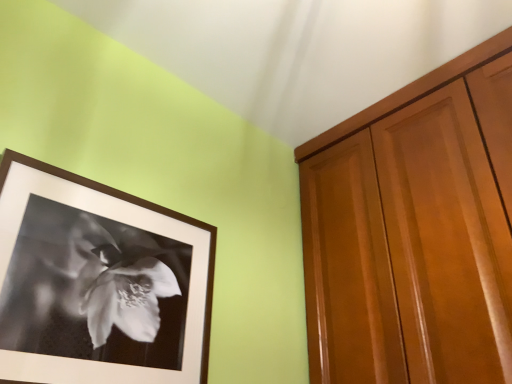
The image size is (512, 384). Describe the element at coordinates (414, 231) in the screenshot. I see `glossy wood cabinetry at right` at that location.

The height and width of the screenshot is (384, 512). What are the coordinates of `glossy wood cabinetry at right` in the screenshot? It's located at (414, 231).

The width and height of the screenshot is (512, 384). What do you see at coordinates (98, 282) in the screenshot?
I see `black matte picture frame at upper left` at bounding box center [98, 282].

I want to click on black matte picture frame at upper left, so click(98, 282).

At what (x,y) coordinates should I click in order to perform the action: click on glossy wood cabinetry at right. Please return your answer as a coordinate pair (x, y). Image resolution: width=512 pixels, height=384 pixels. Looking at the image, I should click on (414, 231).

Considering the positions of objects glossy wood cabinetry at right and black matte picture frame at upper left in the image provided, who is more to the left, glossy wood cabinetry at right or black matte picture frame at upper left?

Positioned to the left is black matte picture frame at upper left.

Is glossy wood cabinetry at right further to camera compared to black matte picture frame at upper left?

Answer: Yes, glossy wood cabinetry at right is further from the camera.

Which is in front, point (328, 378) or point (15, 346)?

Point (15, 346)

From the image's perspective, which is above, glossy wood cabinetry at right or black matte picture frame at upper left?

glossy wood cabinetry at right appears higher in the image.

In the scene shown: From a real-world perspective, is glossy wood cabinetry at right beneath black matte picture frame at upper left?

Incorrect, from a real-world perspective, glossy wood cabinetry at right is higher than black matte picture frame at upper left.

Which of these two, glossy wood cabinetry at right or black matte picture frame at upper left, is thinner?

black matte picture frame at upper left.

Does glossy wood cabinetry at right have a greater height compared to black matte picture frame at upper left?

Yes, glossy wood cabinetry at right is taller than black matte picture frame at upper left.

Is glossy wood cabinetry at right bigger or smaller than black matte picture frame at upper left?

Considering their sizes, glossy wood cabinetry at right takes up more space than black matte picture frame at upper left.

Is glossy wood cabinetry at right inside or outside of black matte picture frame at upper left?

glossy wood cabinetry at right is located beyond the bounds of black matte picture frame at upper left.

In the scene shown: Would you say glossy wood cabinetry at right is a long distance from black matte picture frame at upper left?

No.

In the scene shown: Is black matte picture frame at upper left at the back of glossy wood cabinetry at right?

No, black matte picture frame at upper left is not at the back of glossy wood cabinetry at right.

I want to click on picture frame that appears on the left of glossy wood cabinetry at right, so click(98, 282).

Which is more to the right, black matte picture frame at upper left or glossy wood cabinetry at right?

glossy wood cabinetry at right is more to the right.

Considering the relative positions of black matte picture frame at upper left and glossy wood cabinetry at right in the image provided, is black matte picture frame at upper left in front of glossy wood cabinetry at right?

Yes, black matte picture frame at upper left is closer to the camera.

Which is behind, point (143, 301) or point (436, 288)?

The point (436, 288) is behind.

From the image's perspective, is black matte picture frame at upper left positioned above or below glossy wood cabinetry at right?

black matte picture frame at upper left is below glossy wood cabinetry at right.

From a real-world perspective, is black matte picture frame at upper left positioned over glossy wood cabinetry at right based on gravity?

Actually, black matte picture frame at upper left is physically below glossy wood cabinetry at right in the real world.

Does black matte picture frame at upper left have a lesser width compared to glossy wood cabinetry at right?

Yes, black matte picture frame at upper left is thinner than glossy wood cabinetry at right.

Is black matte picture frame at upper left shorter than glossy wood cabinetry at right?

Indeed, black matte picture frame at upper left has a lesser height compared to glossy wood cabinetry at right.

Between black matte picture frame at upper left and glossy wood cabinetry at right, which one has larger size?

glossy wood cabinetry at right is bigger.

Is black matte picture frame at upper left located outside glossy wood cabinetry at right?

That's correct, black matte picture frame at upper left is outside of glossy wood cabinetry at right.

Is black matte picture frame at upper left far from glossy wood cabinetry at right?

Actually, black matte picture frame at upper left and glossy wood cabinetry at right are a little close together.

Is black matte picture frame at upper left oriented towards glossy wood cabinetry at right?

No, black matte picture frame at upper left is not turned towards glossy wood cabinetry at right.

I want to click on cabinetry located on the right of black matte picture frame at upper left, so click(414, 231).

This screenshot has width=512, height=384. What are the coordinates of `cabinetry on the right of black matte picture frame at upper left` in the screenshot? It's located at [414, 231].

Find the location of a particular element. The image size is (512, 384). picture frame below the glossy wood cabinetry at right (from a real-world perspective) is located at coordinates (98, 282).